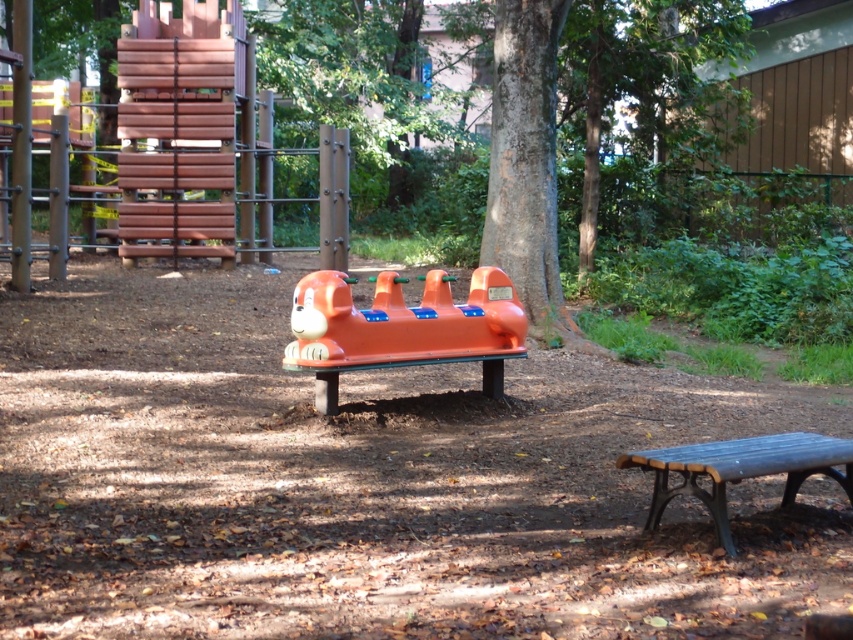
Question: Does orange plastic toy at center have a larger size compared to wooden bench at lower right?

Choices:
 (A) no
 (B) yes

Answer: (B)

Question: Does orange plastic toy at center have a larger size compared to wooden bench at lower right?

Choices:
 (A) yes
 (B) no

Answer: (A)

Question: Where is orange plastic toy at center located in relation to wooden bench at lower right in the image?

Choices:
 (A) above
 (B) below

Answer: (A)

Question: Which of the following is the farthest from the observer?

Choices:
 (A) (473, 285)
 (B) (764, 436)

Answer: (A)